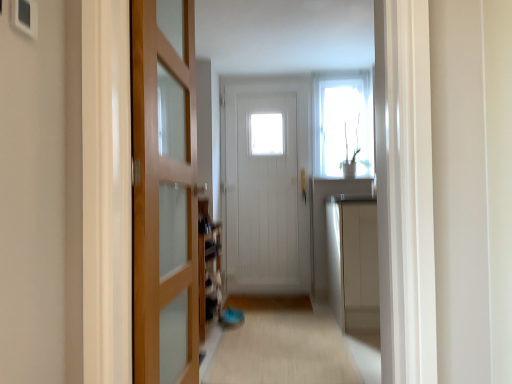
Question: Does white wooden door at center, the 2th door when ordered from left to right, come behind beige carpet at center?

Choices:
 (A) yes
 (B) no

Answer: (A)

Question: Does white wooden door at center, the 2th door when ordered from left to right, lie in front of beige carpet at center?

Choices:
 (A) yes
 (B) no

Answer: (B)

Question: From the image's perspective, is white wooden door at center, acting as the first door starting from the back, over beige carpet at center?

Choices:
 (A) no
 (B) yes

Answer: (B)

Question: Would you say beige carpet at center is part of white wooden door at center, which is the 2th door in front-to-back order,'s contents?

Choices:
 (A) no
 (B) yes

Answer: (A)

Question: Considering the relative sizes of white wooden door at center, the first door from the right, and beige carpet at center in the image provided, is white wooden door at center, the first door from the right, wider than beige carpet at center?

Choices:
 (A) yes
 (B) no

Answer: (B)

Question: Is white wooden door at center, the 2th door when ordered from left to right, to the left of beige carpet at center from the viewer's perspective?

Choices:
 (A) yes
 (B) no

Answer: (A)

Question: Is beige carpet at center at the right side of white glossy window at upper center?

Choices:
 (A) yes
 (B) no

Answer: (B)

Question: From a real-world perspective, is beige carpet at center physically above white glossy window at upper center?

Choices:
 (A) no
 (B) yes

Answer: (A)

Question: Can white glossy window at upper center be found inside beige carpet at center?

Choices:
 (A) no
 (B) yes

Answer: (A)

Question: Does beige carpet at center have a greater height compared to white glossy window at upper center?

Choices:
 (A) yes
 (B) no

Answer: (B)

Question: Can you confirm if beige carpet at center is positioned to the left of white glossy window at upper center?

Choices:
 (A) yes
 (B) no

Answer: (A)

Question: From the image's perspective, would you say beige carpet at center is shown under white glossy window at upper center?

Choices:
 (A) no
 (B) yes

Answer: (B)

Question: Does white glossy window at upper center have a greater height compared to white wooden door at center, the 2th door when ordered from left to right?

Choices:
 (A) yes
 (B) no

Answer: (B)